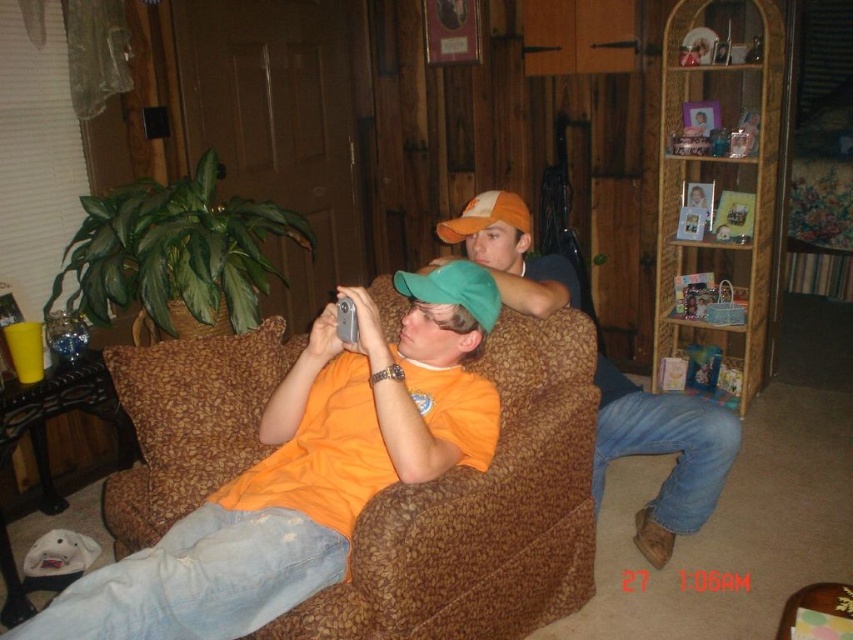
Is brown textured armchair at center above orange cotton shirt at center?

Incorrect, brown textured armchair at center is not positioned above orange cotton shirt at center.

Is brown textured armchair at center smaller than orange cotton shirt at center?

Yes.

The image size is (853, 640). I want to click on brown textured armchair at center, so click(x=482, y=513).

Is wooden bookshelf at upper right positioned at the back of orange cotton shirt at center?

Yes, it is behind orange cotton shirt at center.

Can you confirm if wooden bookshelf at upper right is bigger than orange cotton shirt at center?

Indeed, wooden bookshelf at upper right has a larger size compared to orange cotton shirt at center.

Does point (772, 70) come farther from viewer compared to point (598, 499)?

That is True.

Where is `wooden bookshelf at upper right`? The image size is (853, 640). wooden bookshelf at upper right is located at coordinates (720, 180).

Can you confirm if brown textured armchair at center is thinner than wooden bookshelf at upper right?

In fact, brown textured armchair at center might be wider than wooden bookshelf at upper right.

Is point (160, 508) positioned after point (756, 83)?

No, (160, 508) is closer to viewer.

Who is more forward, (526, 323) or (724, 260)?

Point (526, 323)

Where is `brown textured armchair at center`? The height and width of the screenshot is (640, 853). brown textured armchair at center is located at coordinates (482, 513).